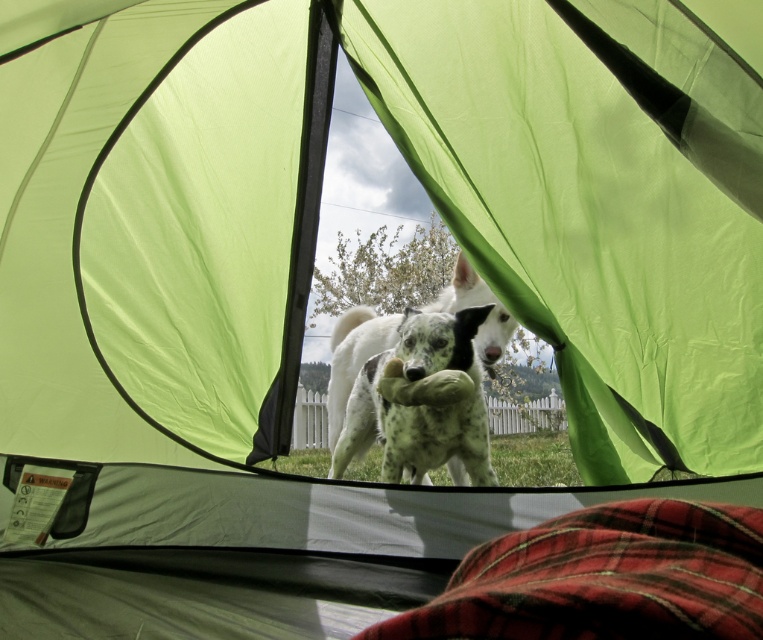
Question: Does red plaid blanket at lower right have a smaller size compared to speckled fur dog at center?

Choices:
 (A) no
 (B) yes

Answer: (B)

Question: Observing the image, what is the correct spatial positioning of red plaid blanket at lower right in reference to speckled fur dog at center?

Choices:
 (A) above
 (B) below

Answer: (A)

Question: Is red plaid blanket at lower right below speckled fur dog at center?

Choices:
 (A) no
 (B) yes

Answer: (A)